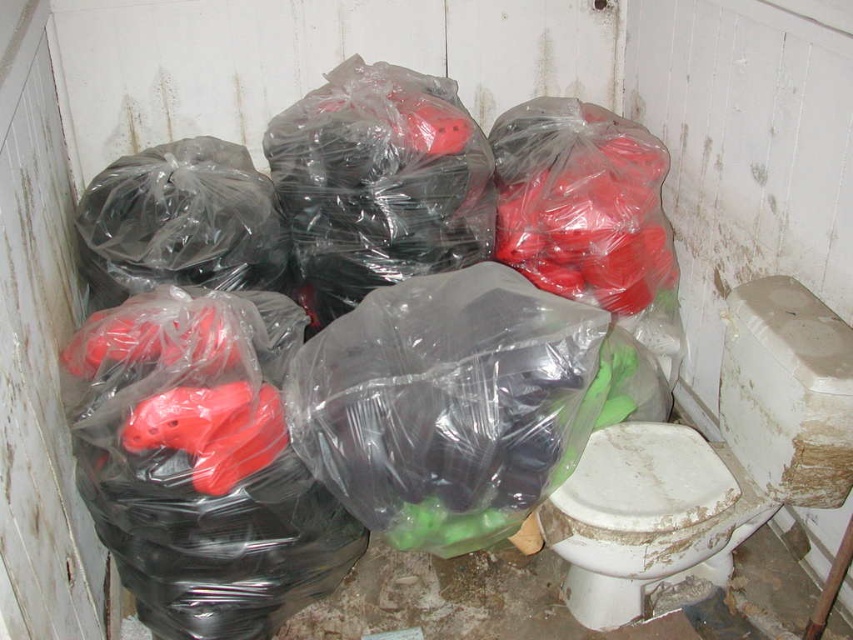
You are moving items in a bathroom and need to place a new toilet seat cover. You see the translucent plastic bags at center and the white glossy toilet bowl at lower right. Which object is closer to the left side of the room?

The translucent plastic bags at center is to the left of white glossy toilet bowl at lower right, so the translucent plastic bags at center is closer to the left side of the room.

You are a delivery person who needs to place a package that is 40 centimeters long in this bathroom corner. The package must be placed between the translucent plastic bags at center and the white glossy toilet bowl at lower right. Is there enough space between them to fit the package?

The distance between the translucent plastic bags at center and the white glossy toilet bowl at lower right is 35.28 centimeters. Since the package is 40 centimeters long, it is longer than the available space. Therefore, the package cannot be placed between them.

You are trying to determine if the translucent plastic bags at center can be moved closer to the white glossy toilet bowl at lower right without overlapping. Based on their sizes, is this possible?

The translucent plastic bags at center are wider than the white glossy toilet bowl at lower right, so moving them closer might not be possible without overlapping since the bags are wider.